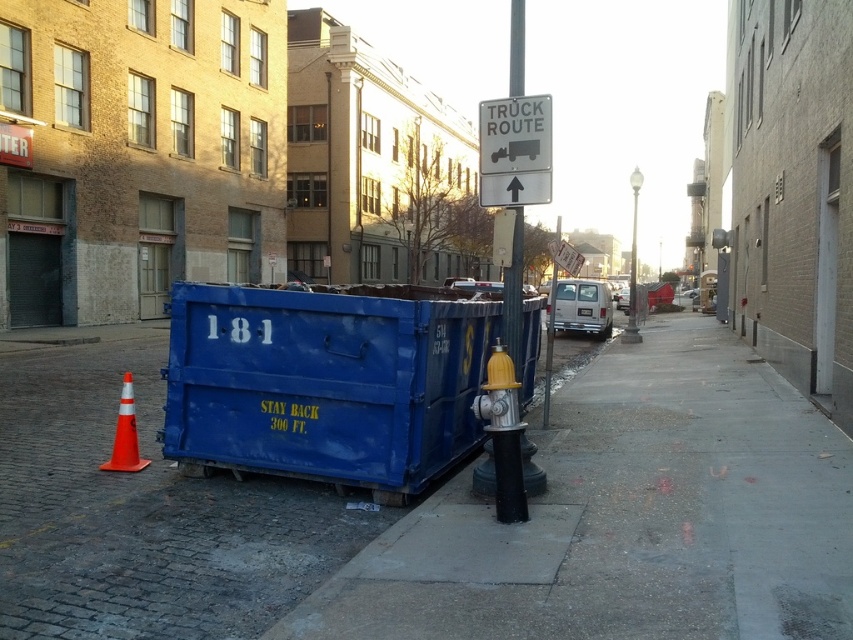
Question: Which is nearer to the white plastic sign at upper center?

Choices:
 (A) metallic pole at center
 (B) blue plastic container at center
 (C) orange reflective cone at lower left
 (D) yellow metallic fire hydrant at center

Answer: (D)

Question: Which object is closer to the camera taking this photo?

Choices:
 (A) gray concrete sidewalk at lower center
 (B) blue plastic container at center

Answer: (A)

Question: Is gray concrete sidewalk at lower center smaller than blue plastic container at center?

Choices:
 (A) yes
 (B) no

Answer: (A)

Question: Is blue plastic container at center positioned before yellow metallic fire hydrant at center?

Choices:
 (A) no
 (B) yes

Answer: (A)

Question: Does gray concrete sidewalk at lower center have a smaller size compared to blue concrete sidewalk at center?

Choices:
 (A) no
 (B) yes

Answer: (B)

Question: Which point appears closest to the camera in this image?

Choices:
 (A) (518, 557)
 (B) (457, 413)
 (C) (508, 129)

Answer: (A)